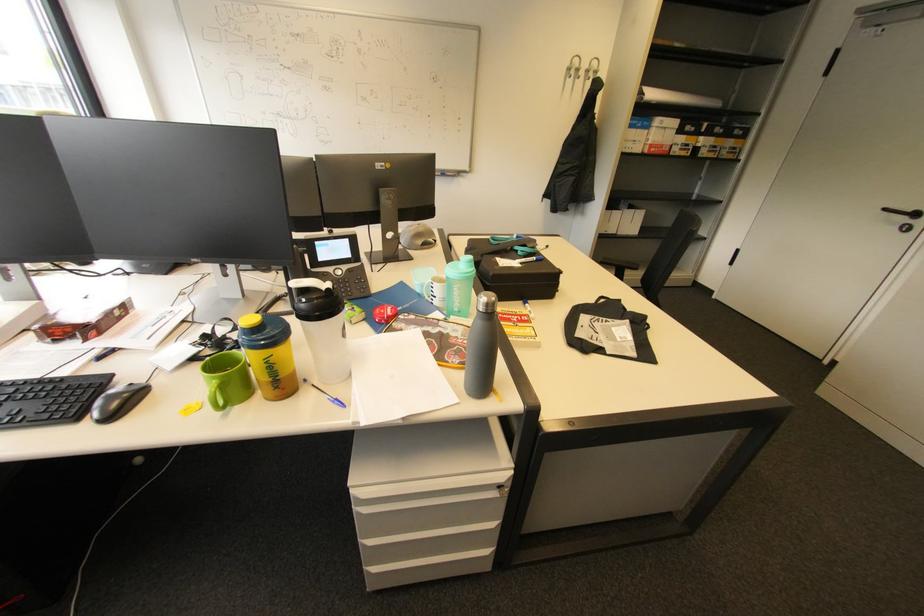
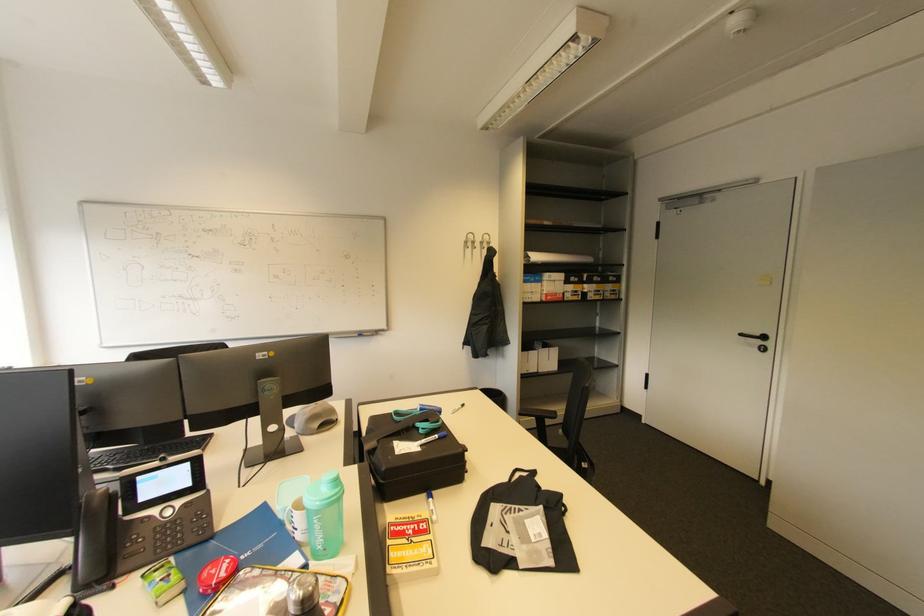
Where in the second image is the point corresponding to point (459, 290) from the first image?

(320, 522)